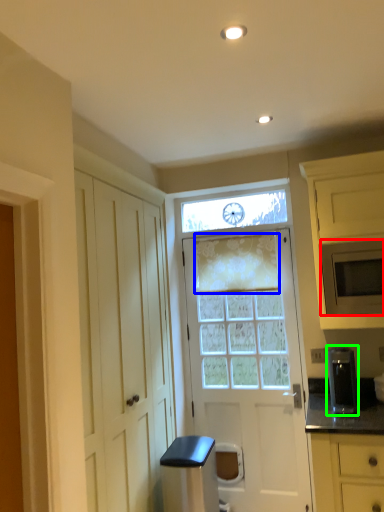
Question: Which object is the closest to the microwave oven (highlighted by a red box)? Choose among these: curtain (highlighted by a blue box) or appliance (highlighted by a green box).

Choices:
 (A) curtain
 (B) appliance

Answer: (B)